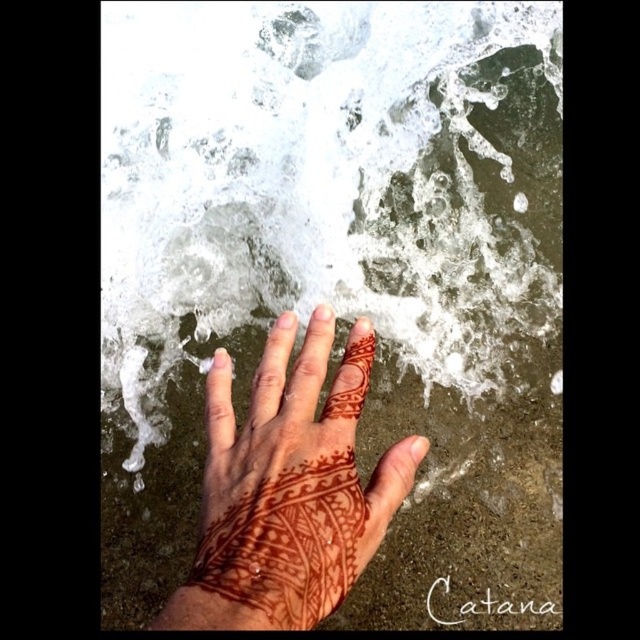
You are a photographer trying to capture the intricate details of the brown henna tattoo at center and the white frothy water at center in the image. Which object occupies a larger area in the scene?

The white frothy water at center is bigger than the brown henna tattoo at center, so the white frothy water at center occupies a larger area in the scene.

You are a photographer trying to capture the intricate details of the brown henna tattoo at center and the white frothy water at center. Since both are at the center, which one is positioned more to the right?

The white frothy water at center is to the right of brown henna tattoo at center, so the white frothy water at center is positioned more to the right.